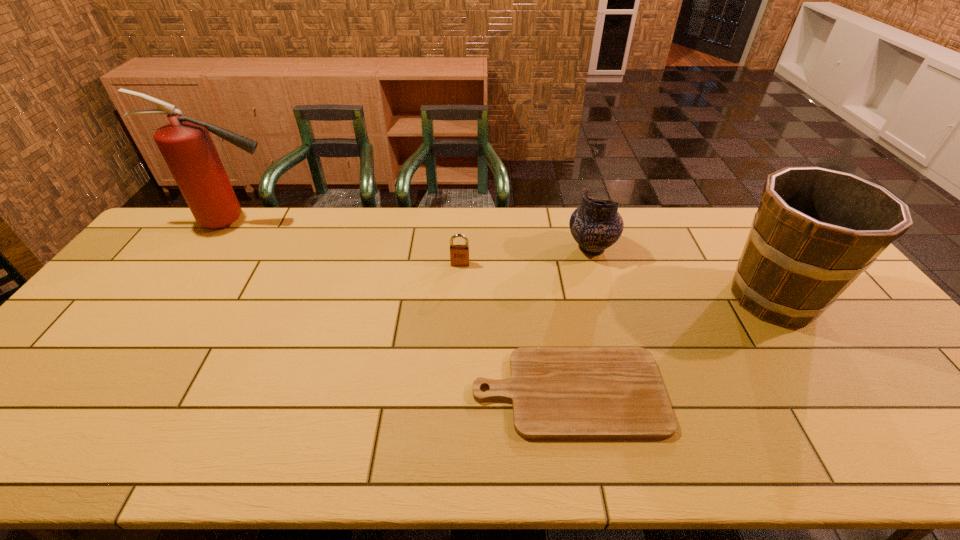
The height and width of the screenshot is (540, 960). Identify the location of free region located on the left of the second tallest object. (660, 298).

Where is `free space located on the right of the third shortest object`? The width and height of the screenshot is (960, 540). free space located on the right of the third shortest object is located at coordinates (699, 248).

Where is `free spot located 0.080m on the front-facing side of the fourth tallest object`? The image size is (960, 540). free spot located 0.080m on the front-facing side of the fourth tallest object is located at coordinates (459, 285).

The width and height of the screenshot is (960, 540). Identify the location of vacant space located 0.190m on the left of the shortest object. (393, 392).

At what (x,y) coordinates should I click in order to perform the action: click on fire extinguisher located at the far edge. Please return your answer as a coordinate pair (x, y). Looking at the image, I should click on (185, 143).

Locate an element on the screen. This screenshot has width=960, height=540. pottery that is at the far edge is located at coordinates (596, 225).

Identify the location of object present at the near edge. (557, 392).

This screenshot has width=960, height=540. Identify the location of object that is at the left edge. (185, 143).

Where is `object that is positioned at the right edge`? This screenshot has width=960, height=540. object that is positioned at the right edge is located at coordinates (816, 230).

The height and width of the screenshot is (540, 960). What are the coordinates of `object at the far left corner` in the screenshot? It's located at (185, 143).